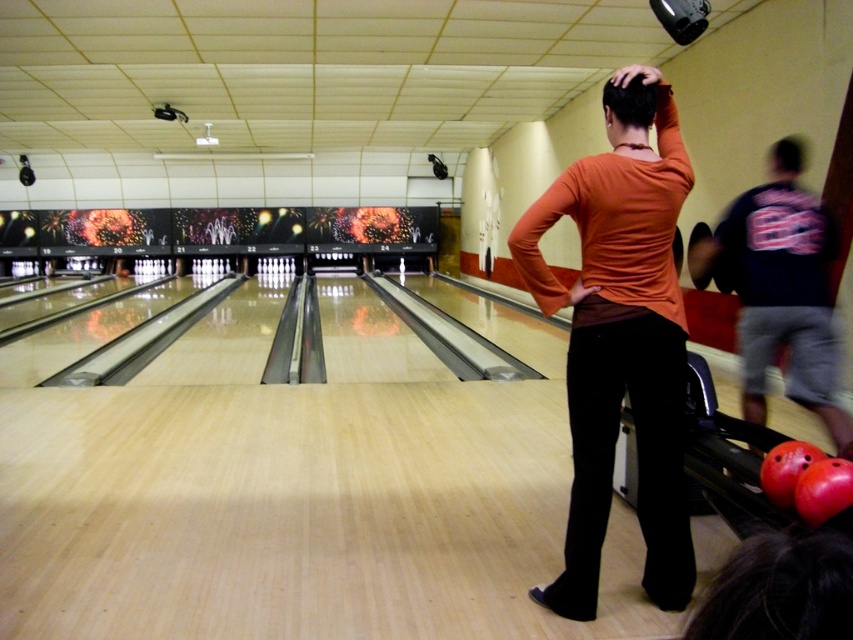
Is short brown hair at center taller than blurred hair at upper right?

Correct, short brown hair at center is much taller as blurred hair at upper right.

Between short brown hair at center and blurred hair at upper right, which one is positioned lower?

short brown hair at center is below.

Which is in front, point (637, 134) or point (773, 157)?

Point (637, 134)

This screenshot has width=853, height=640. I want to click on short brown hair at center, so click(630, 106).

Between point (602, 452) and point (822, 300), which one is positioned in front?

Positioned in front is point (602, 452).

Does orange matte shirt at center have a larger size compared to dark blue t-shirt at center?

Yes.

Identify the location of orange matte shirt at center. The width and height of the screenshot is (853, 640). (619, 339).

Between dark blue t-shirt at center and short brown hair at center, which one appears on the right side from the viewer's perspective?

dark blue t-shirt at center is more to the right.

Is point (820, 310) less distant than point (648, 81)?

No, (820, 310) is behind (648, 81).

Image resolution: width=853 pixels, height=640 pixels. I want to click on dark blue t-shirt at center, so click(782, 291).